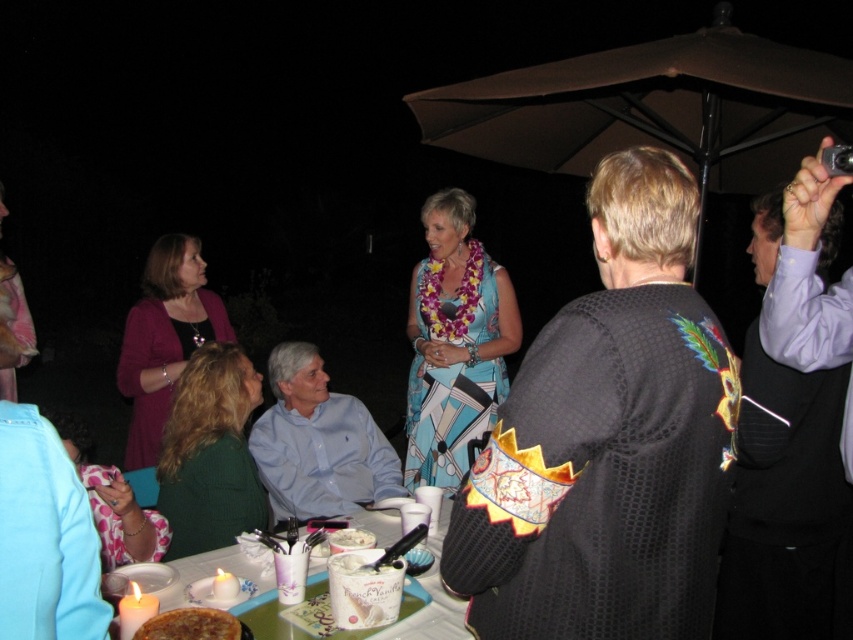
Describe the element at coordinates (785, 506) in the screenshot. I see `purple shirt at upper right` at that location.

Is purple shirt at upper right bigger than white paper plate at center?

Indeed, purple shirt at upper right has a larger size compared to white paper plate at center.

Is point (733, 513) less distant than point (361, 541)?

No, it is not.

Find the location of `purple shirt at upper right`. purple shirt at upper right is located at coordinates (785, 506).

Can you confirm if blue printed dress at center is bigger than green knitted sweater at lower left?

Yes.

Find the location of `blue printed dress at center`. blue printed dress at center is located at coordinates (454, 342).

How distant is green knitted sweater at lower left from white glossy table at center?

A distance of 21.91 inches exists between green knitted sweater at lower left and white glossy table at center.

Does green knitted sweater at lower left appear on the left side of white glossy table at center?

Yes, green knitted sweater at lower left is to the left of white glossy table at center.

Is point (241, 410) positioned before point (195, 561)?

No.

At what (x,y) coordinates should I click in order to perform the action: click on green knitted sweater at lower left. Please return your answer as a coordinate pair (x, y). Image resolution: width=853 pixels, height=640 pixels. Looking at the image, I should click on (210, 452).